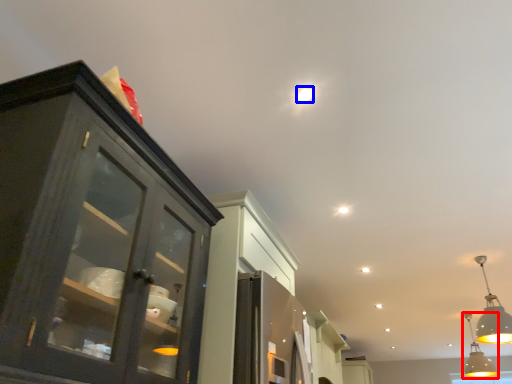
Question: Which object appears closest to the camera in this image, light fixture (highlighted by a red box) or droplight (highlighted by a blue box)?

Choices:
 (A) light fixture
 (B) droplight

Answer: (B)